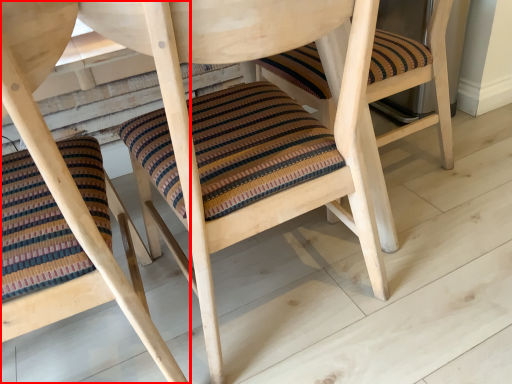
Question: In this image, where is chair (annotated by the red box) located relative to chair?

Choices:
 (A) right
 (B) left

Answer: (B)